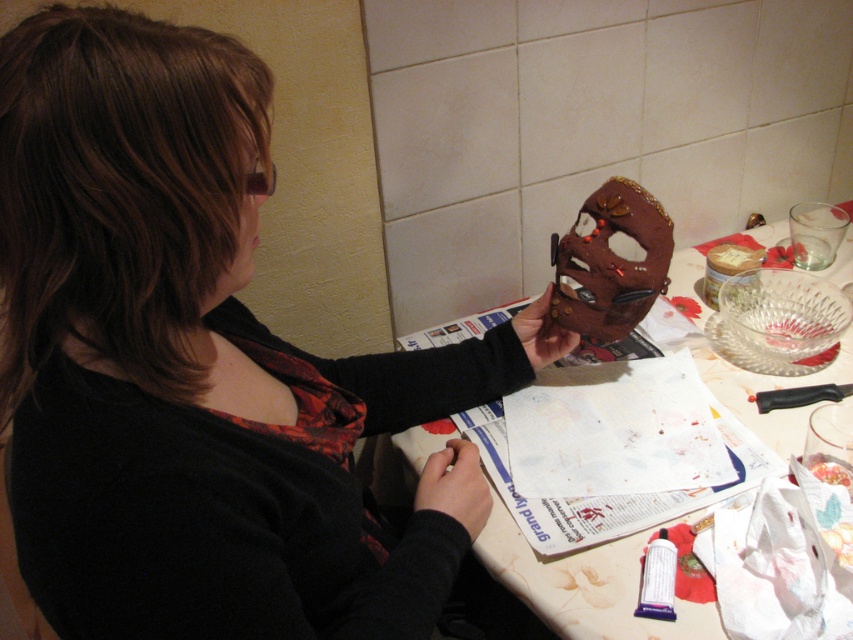
Question: Which point appears closest to the camera in this image?

Choices:
 (A) pos(96,93)
 (B) pos(531,605)

Answer: (A)

Question: Can you confirm if matte brown mask at upper right is wider than matte brown mask at center?

Choices:
 (A) no
 (B) yes

Answer: (A)

Question: Is the position of matte brown mask at upper right more distant than that of matte brown mask at center?

Choices:
 (A) yes
 (B) no

Answer: (B)

Question: Does matte brown mask at upper right appear under matte brown mask at center?

Choices:
 (A) yes
 (B) no

Answer: (A)